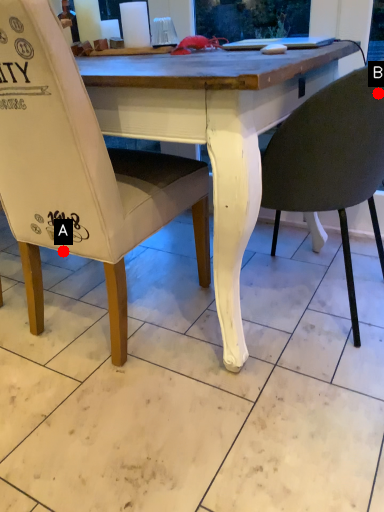
Question: Two points are circled on the image, labeled by A and B beside each circle. Which of the following is the closest to the observer?

Choices:
 (A) A is closer
 (B) B is closer

Answer: (B)